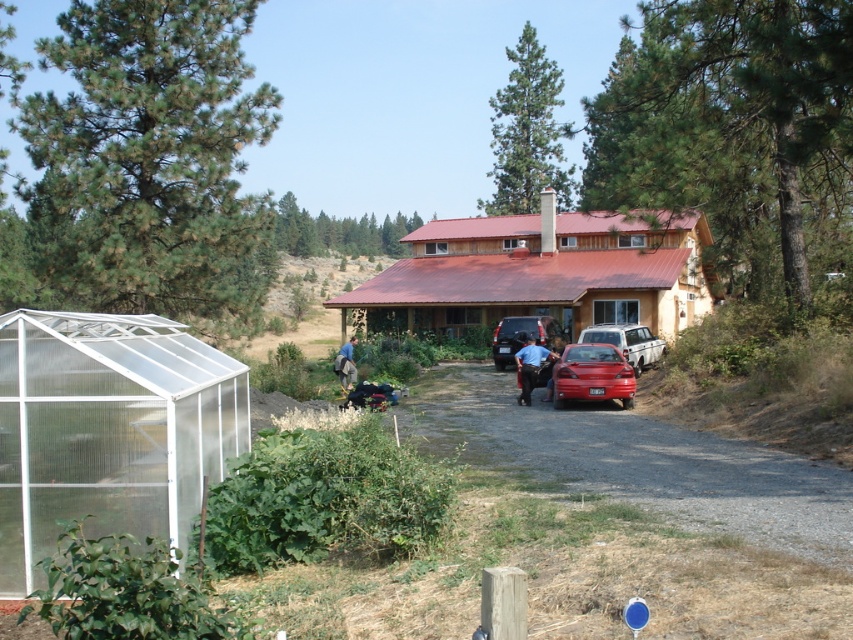
You are a visitor arriving at the house and notice two trees at the upper center of the scene. Which tree is taller between the green rough bark tree at upper center and the green matte pine at upper center?

The green rough bark tree at upper center is taller than the green matte pine at upper center according to the description.

You are planning to park your car in the driveway but need to know which vehicle takes up more space. Which one is larger between the matte red sedan at center and the metallic silver sedan at center?

The matte red sedan at center is bigger than the metallic silver sedan at center, so it takes up more space.